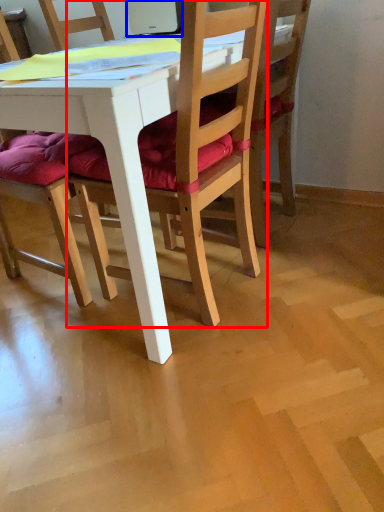
Question: Among these objects, which one is nearest to the camera, chair (highlighted by a red box) or laptop (highlighted by a blue box)?

Choices:
 (A) chair
 (B) laptop

Answer: (A)